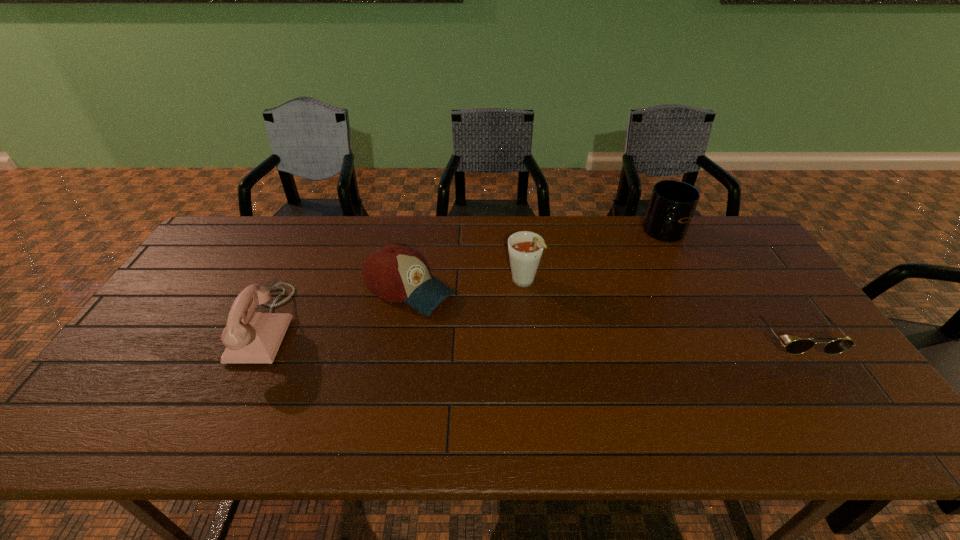
Identify the location of free spot on the desktop that is between the telephone and the sunglasses and is positioned with the handle on the side of the mug. (587, 333).

Find the location of a particular element. The image size is (960, 540). free space on the desktop that is between the telephone and the rightmost object and is positioned on the front-facing side of the second object from left to right is located at coordinates pyautogui.click(x=485, y=330).

The width and height of the screenshot is (960, 540). What are the coordinates of `vacant space on the desktop that is between the leftmost object and the rightmost object and is positioned on the drink side of the root beer` in the screenshot? It's located at (552, 332).